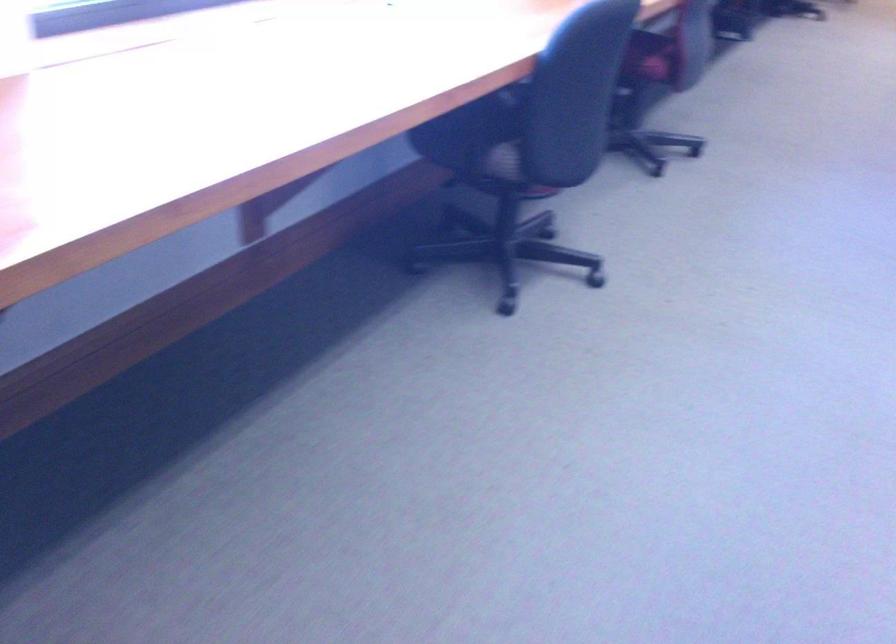
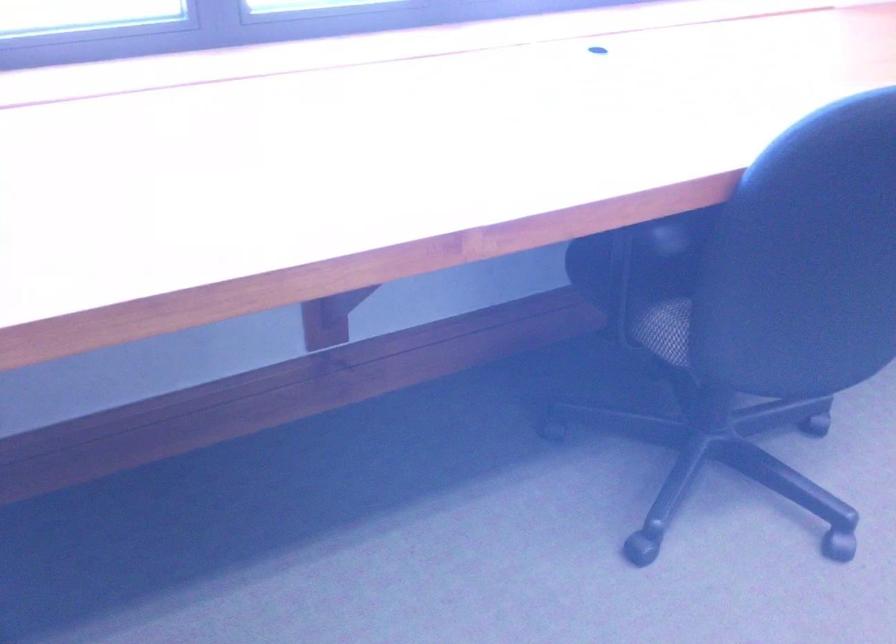
Where in the second image is the point corresponding to [479,136] from the first image?

(645, 279)